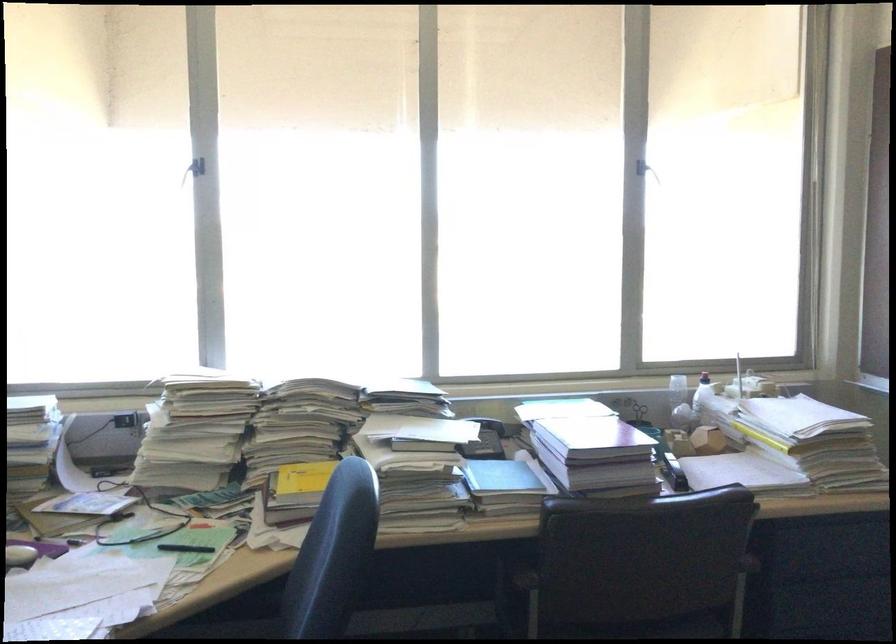
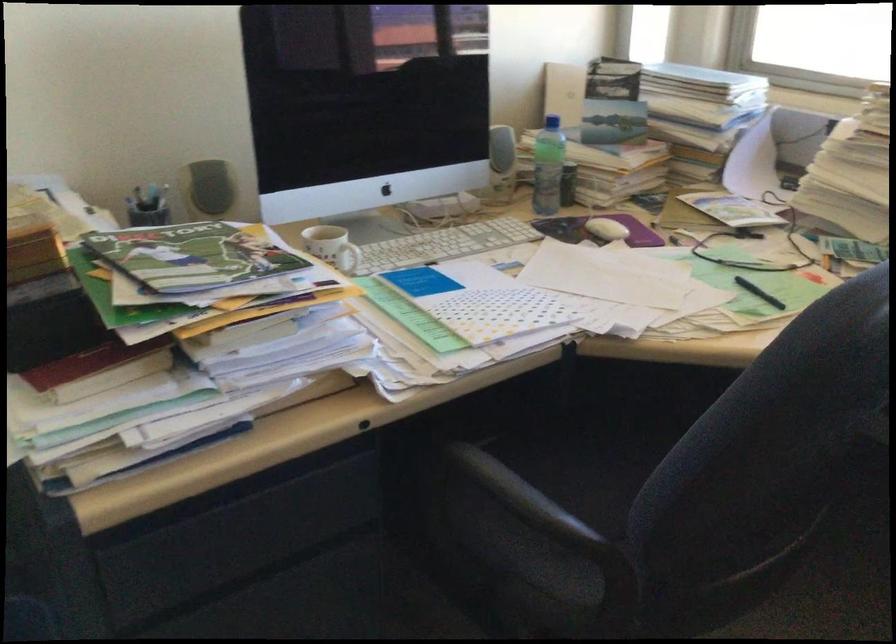
Where in the second image is the point corresponding to point (190, 552) from the first image?

(759, 292)